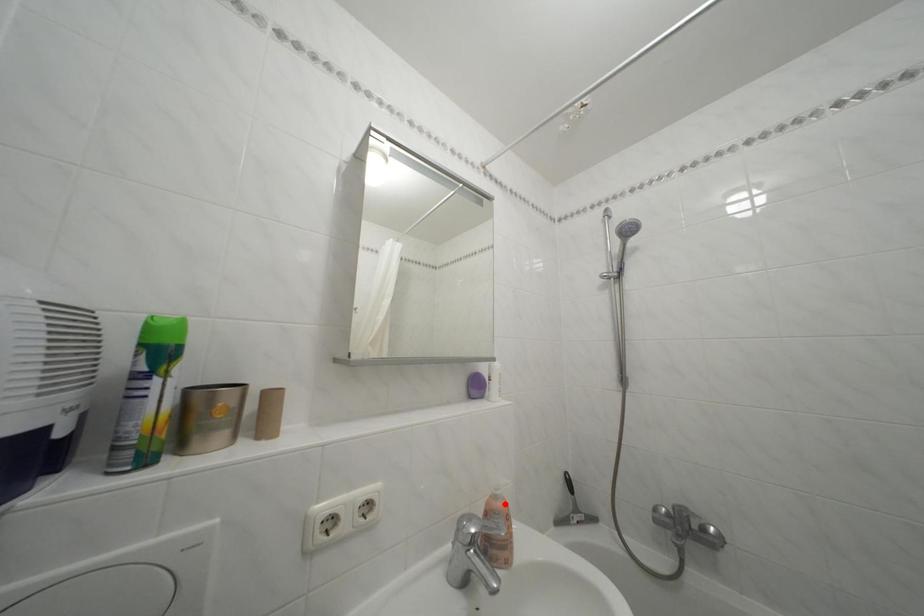
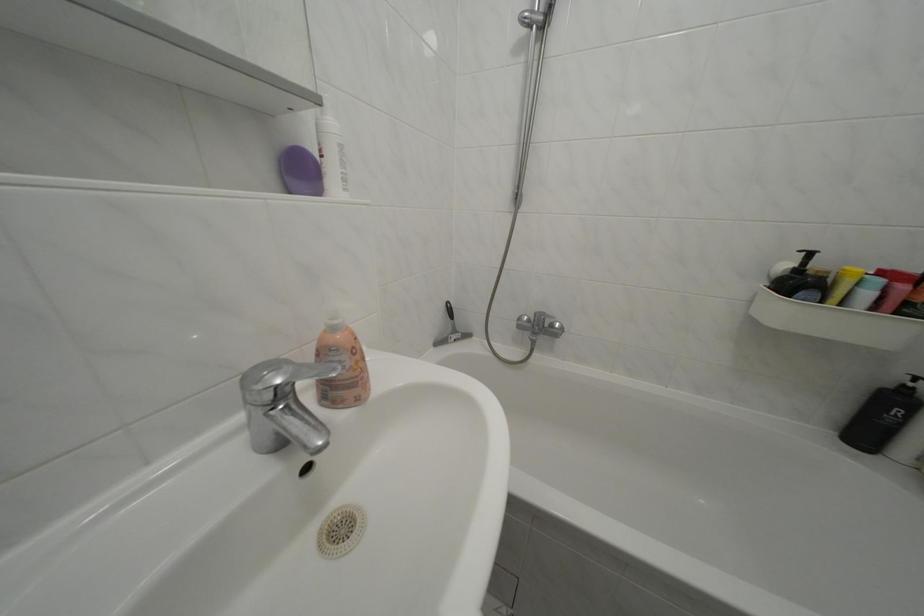
Where in the second image is the point corresponding to the highlighted location from the first image?

(342, 334)